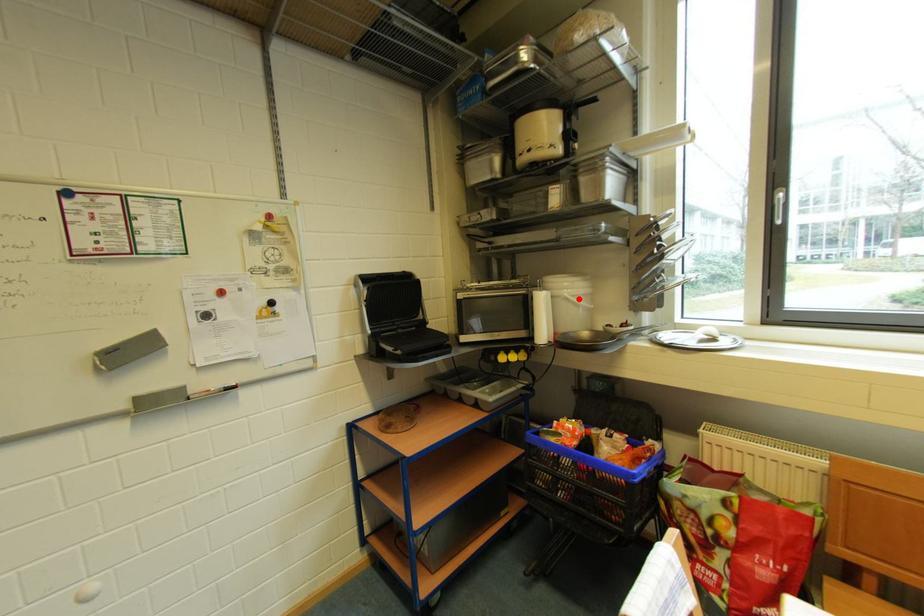
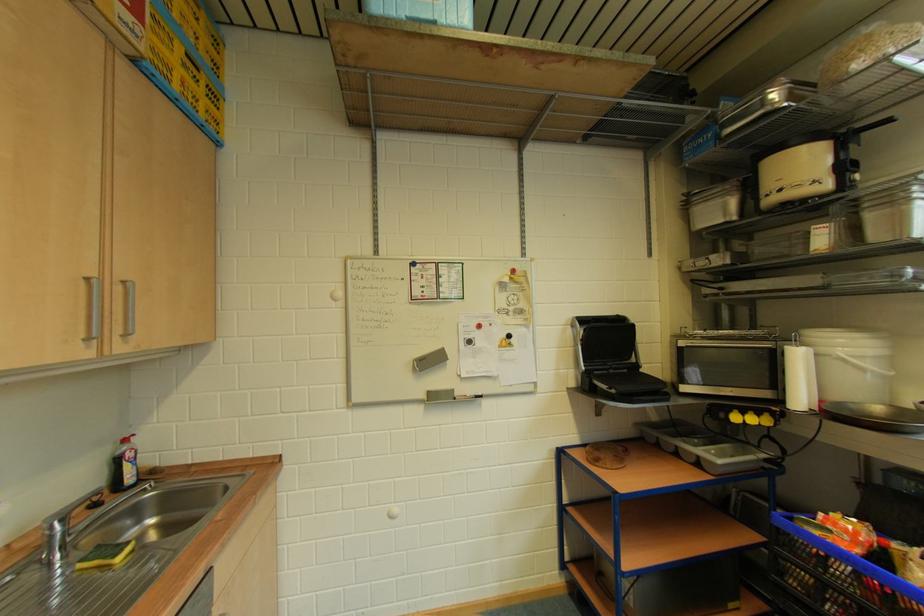
Where in the second image is the point corresponding to the highlighted location from the first image?

(858, 360)